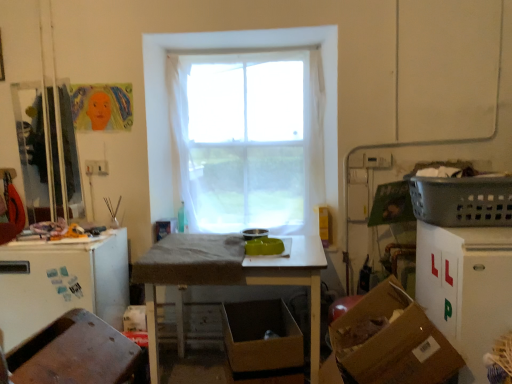
Question: From the image's perspective, is brown cardboard box at lower right, positioned as the 1th cardboard box in right-to-left order, over wooden table at center?

Choices:
 (A) no
 (B) yes

Answer: (A)

Question: Does brown cardboard box at lower right, acting as the 1th cardboard box starting from the front, have a smaller size compared to wooden table at center?

Choices:
 (A) no
 (B) yes

Answer: (B)

Question: Is brown cardboard box at lower right, which is the second cardboard box in back-to-front order, turned away from wooden table at center?

Choices:
 (A) yes
 (B) no

Answer: (B)

Question: Is brown cardboard box at lower right, positioned as the 1th cardboard box in right-to-left order, located outside wooden table at center?

Choices:
 (A) yes
 (B) no

Answer: (A)

Question: Does brown cardboard box at lower right, which is the second cardboard box in back-to-front order, turn towards wooden table at center?

Choices:
 (A) yes
 (B) no

Answer: (B)

Question: From a real-world perspective, does brown cardboard box at lower right, which is the second cardboard box in back-to-front order, stand above wooden table at center?

Choices:
 (A) no
 (B) yes

Answer: (B)

Question: Is wooden table at center thinner than brown cardboard box at lower center, arranged as the 2th cardboard box when viewed from the front?

Choices:
 (A) no
 (B) yes

Answer: (A)

Question: Does wooden table at center lie behind brown cardboard box at lower center, marked as the first cardboard box in a back-to-front arrangement?

Choices:
 (A) no
 (B) yes

Answer: (A)

Question: Can you confirm if wooden table at center is wider than brown cardboard box at lower center, arranged as the 2th cardboard box when viewed from the front?

Choices:
 (A) no
 (B) yes

Answer: (B)

Question: From the image's perspective, would you say wooden table at center is positioned over brown cardboard box at lower center, the second cardboard box in the right-to-left sequence?

Choices:
 (A) yes
 (B) no

Answer: (A)

Question: Is wooden table at center turned away from brown cardboard box at lower center, arranged as the 2th cardboard box when viewed from the front?

Choices:
 (A) yes
 (B) no

Answer: (A)

Question: Considering the relative sizes of wooden table at center and brown cardboard box at lower center, the second cardboard box in the right-to-left sequence, in the image provided, is wooden table at center bigger than brown cardboard box at lower center, the second cardboard box in the right-to-left sequence,?

Choices:
 (A) no
 (B) yes

Answer: (B)

Question: Is gray plastic laundry basket at right touching brown cardboard box at lower right, the 2th cardboard box viewed from the left?

Choices:
 (A) no
 (B) yes

Answer: (A)